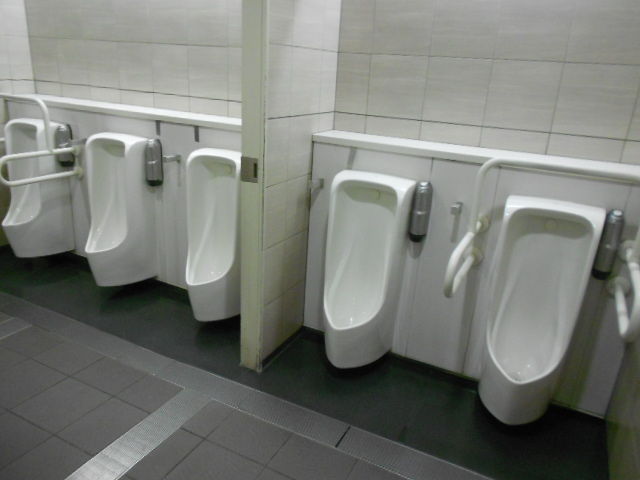
Where is `urinal`? This screenshot has width=640, height=480. urinal is located at coordinates (41, 203), (116, 214), (207, 223), (353, 239), (524, 266).